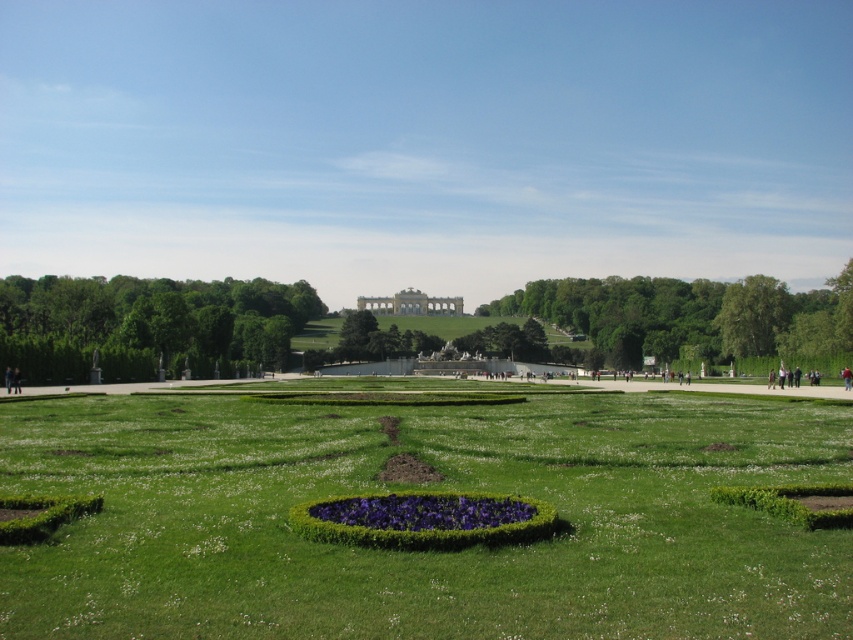
Does green leafy hedge at left have a smaller size compared to purple matte flower bed at center?

Incorrect, green leafy hedge at left is not smaller in size than purple matte flower bed at center.

Which is in front, point (48, 356) or point (521, 520)?

Point (521, 520) is more forward.

This screenshot has width=853, height=640. What are the coordinates of `green leafy hedge at left` in the screenshot? It's located at (146, 323).

Is green hedge at center in front of white stone palace at center?

Yes, green hedge at center is in front of white stone palace at center.

Does green hedge at center appear over white stone palace at center?

No, green hedge at center is not above white stone palace at center.

Who is more forward, (610, 305) or (357, 300)?

Point (610, 305)

This screenshot has height=640, width=853. What are the coordinates of `green hedge at center` in the screenshot? It's located at pyautogui.click(x=692, y=317).

Between green grass at center and white stone palace at center, which one appears on the right side from the viewer's perspective?

From the viewer's perspective, green grass at center appears more on the right side.

Who is lower down, green grass at center or white stone palace at center?

Positioned lower is green grass at center.

Measure the distance between green grass at center and camera.

43.05 feet

Image resolution: width=853 pixels, height=640 pixels. In order to click on green grass at center in this screenshot , I will do `click(428, 490)`.